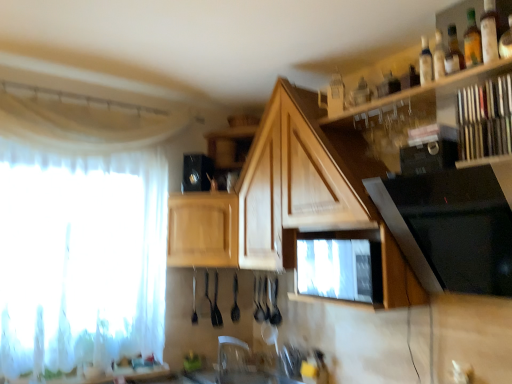
Question: Is wooden shelf at upper right, marked as the second shelf in a right-to-left arrangement, to the left or to the right of black glossy microwave at upper right, which is the second appliance from left to right, in the image?

Choices:
 (A) left
 (B) right

Answer: (B)

Question: From the image's perspective, is wooden shelf at upper right, the first shelf viewed from the left, located above or below black glossy microwave at upper right, arranged as the 2th appliance when viewed from the right?

Choices:
 (A) below
 (B) above

Answer: (B)

Question: Estimate the real-world distances between objects in this image. Which object is farther from the translucent glass bottle at upper right, which appears as the 1th bottle when viewed from the front?

Choices:
 (A) wooden books at upper right, which appears as the second shelf when viewed from the left
 (B) white sheer curtain at left
 (C) clear plastic faucet at center
 (D) black plastic speaker at upper center, which is the third appliance in right-to-left order
 (E) wooden shelf at upper right, the first shelf viewed from the left

Answer: (C)

Question: Based on their relative distances, which object is nearer to the black plastic speaker at upper center, which is the third appliance in right-to-left order?

Choices:
 (A) black glossy microwave at upper right, the second appliance viewed from the front
 (B) wooden shelf at upper right, marked as the second shelf in a right-to-left arrangement
 (C) translucent glass bottle at upper right, which appears as the 2th bottle when viewed from the back
 (D) white sheer curtain at left
 (E) wooden cabinet at center, acting as the second cabinetry starting from the right

Answer: (E)